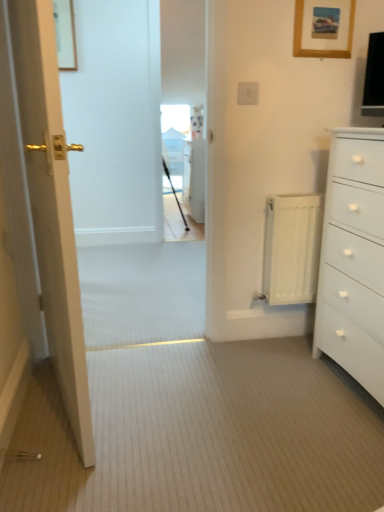
Question: Does white plastic electric outlet at upper center have a lesser width compared to white metallic radiator at right?

Choices:
 (A) yes
 (B) no

Answer: (A)

Question: Is white plastic electric outlet at upper center smaller than white metallic radiator at right?

Choices:
 (A) yes
 (B) no

Answer: (A)

Question: Is white plastic electric outlet at upper center in contact with white metallic radiator at right?

Choices:
 (A) no
 (B) yes

Answer: (A)

Question: Is white plastic electric outlet at upper center oriented away from white metallic radiator at right?

Choices:
 (A) yes
 (B) no

Answer: (B)

Question: From a real-world perspective, is white plastic electric outlet at upper center under white metallic radiator at right?

Choices:
 (A) yes
 (B) no

Answer: (B)

Question: Could you tell me if white plastic electric outlet at upper center is facing white metallic radiator at right?

Choices:
 (A) no
 (B) yes

Answer: (A)

Question: From the image's perspective, is matte gold door at left beneath wooden picture frame at upper left, the second picture frame in the bottom-to-top sequence?

Choices:
 (A) no
 (B) yes

Answer: (B)

Question: Considering the relative sizes of matte gold door at left and wooden picture frame at upper left, acting as the first picture frame starting from the back, in the image provided, is matte gold door at left smaller than wooden picture frame at upper left, acting as the first picture frame starting from the back,?

Choices:
 (A) no
 (B) yes

Answer: (A)

Question: Does matte gold door at left turn towards wooden picture frame at upper left, positioned as the 2th picture frame in front-to-back order?

Choices:
 (A) yes
 (B) no

Answer: (B)

Question: Does matte gold door at left have a lesser width compared to wooden picture frame at upper left, the second picture frame in the bottom-to-top sequence?

Choices:
 (A) yes
 (B) no

Answer: (B)

Question: From the image's perspective, is matte gold door at left above wooden picture frame at upper left, positioned as the 2th picture frame in front-to-back order?

Choices:
 (A) yes
 (B) no

Answer: (B)

Question: Can you confirm if matte gold door at left is shorter than wooden picture frame at upper left, positioned as the 2th picture frame in front-to-back order?

Choices:
 (A) no
 (B) yes

Answer: (A)

Question: Is white plastic electric outlet at upper center to the left of wooden picture frame at upper left, the second picture frame in the bottom-to-top sequence, from the viewer's perspective?

Choices:
 (A) yes
 (B) no

Answer: (B)